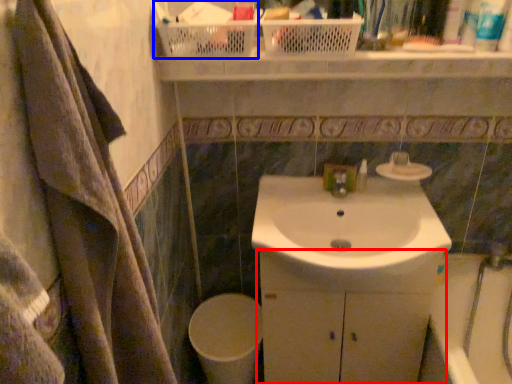
Question: Which point is closer to the camera, bathroom cabinet (highlighted by a red box) or basket (highlighted by a blue box)?

Choices:
 (A) bathroom cabinet
 (B) basket

Answer: (B)